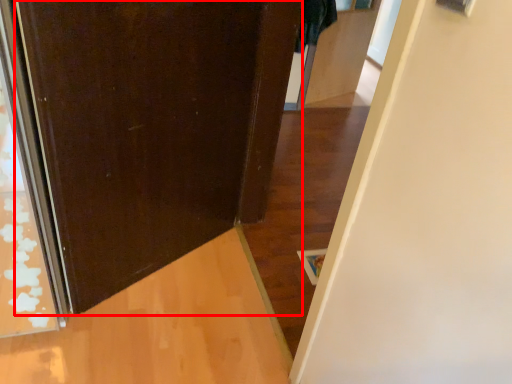
Question: From the image's perspective, what is the correct spatial positioning of door (annotated by the red box) in reference to door?

Choices:
 (A) below
 (B) above

Answer: (A)